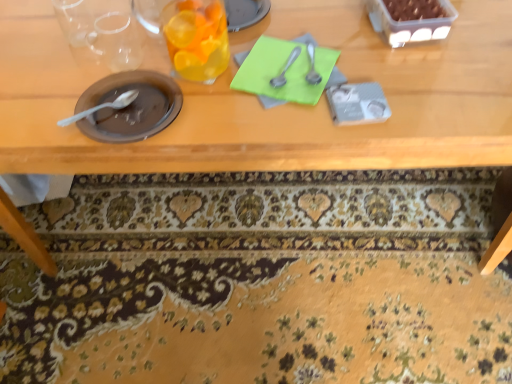
What are the coordinates of `free space below green paper at center (from a real-world perspective)` in the screenshot? It's located at (295, 77).